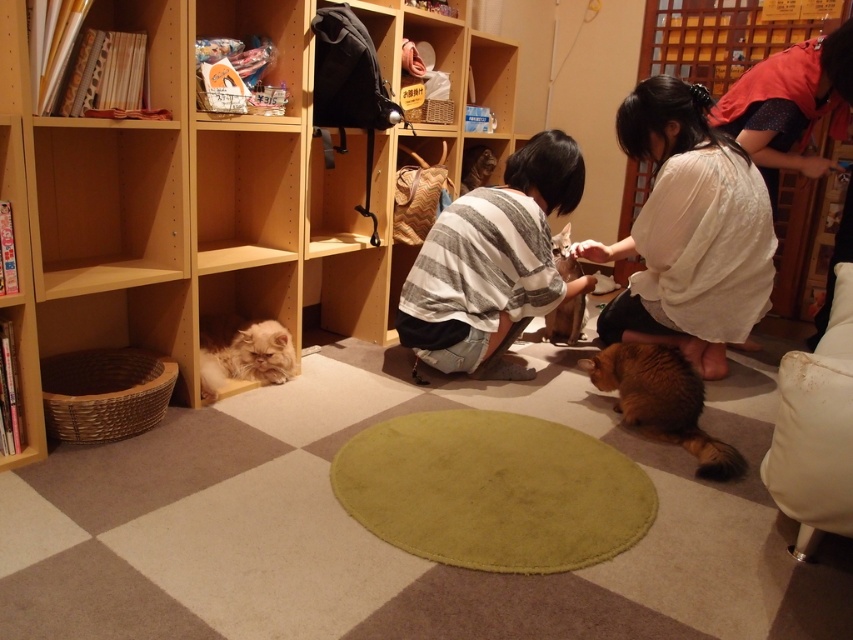
Question: Does light brown wooden bookshelf at lower left appear on the right side of brown fluffy cat at center?

Choices:
 (A) no
 (B) yes

Answer: (A)

Question: Which object is farther from the camera taking this photo?

Choices:
 (A) brown fluffy cat at center
 (B) fluffy white cat at lower left
 (C) golden fur cat at lower right

Answer: (A)

Question: Considering the relative positions of light brown wooden bookshelf at lower left and golden fur cat at lower right in the image provided, where is light brown wooden bookshelf at lower left located with respect to golden fur cat at lower right?

Choices:
 (A) below
 (B) above

Answer: (B)

Question: Is striped cotton shirt at center above brown fluffy cat at center?

Choices:
 (A) yes
 (B) no

Answer: (A)

Question: Which of these objects is positioned closest to the light brown wooden bookshelf at lower left?

Choices:
 (A) golden fur cat at lower right
 (B) brown fluffy cat at center
 (C) fluffy white cat at lower left
 (D) wooden bookshelf at upper right

Answer: (C)

Question: Which object is closer to the camera taking this photo?

Choices:
 (A) wooden bookshelf at upper right
 (B) fluffy white cat at lower left
 (C) striped cotton shirt at center

Answer: (B)